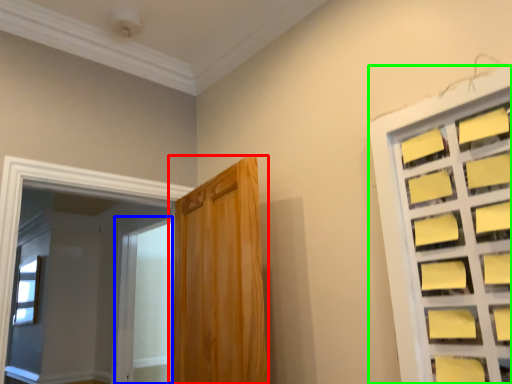
Question: Which is farther away from door (highlighted by a red box)? screen door (highlighted by a blue box) or window (highlighted by a green box)?

Choices:
 (A) screen door
 (B) window

Answer: (A)